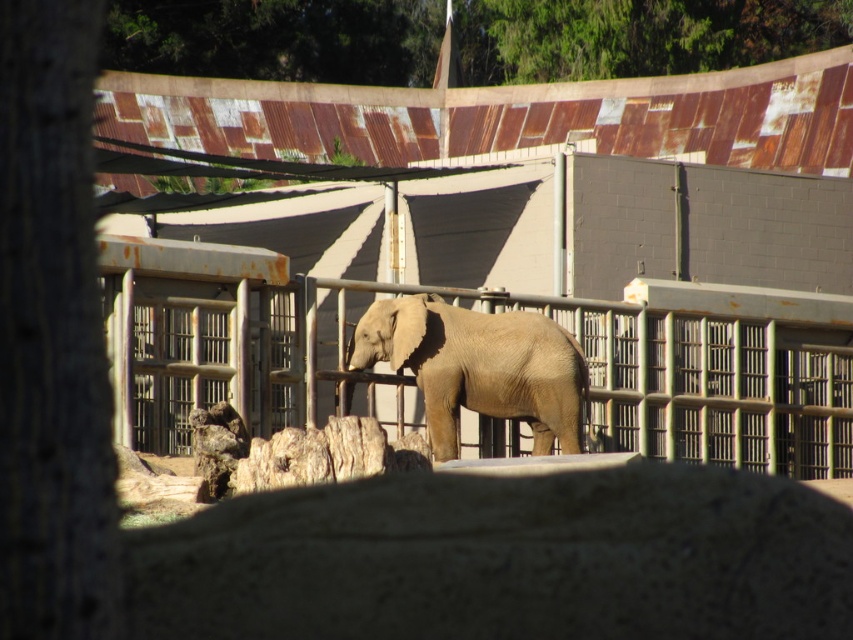
You are standing at the point marked as point (x=65, y=321) and want to reach the elephant in the center of the zoo enclosure. The path between you and the elephant is 16.69 meters long. If your walking speed is 1.5 meters per second, how many seconds will it take you to reach the elephant?

The distance between you and the elephant is 16.69 meters, and your walking speed is 1.5 meters per second. To calculate the time required, divide the distance by the speed. 16.69 divided by 1.5 equals approximately 11.13 seconds. Therefore, it will take about 11.13 seconds to reach the elephant.

You are a zookeeper who needs to move the smooth beige elephant at center to the right side of the brown rough bark tree at left. Is this possible given their current positions?

The brown rough bark tree at left is positioned on the left side of the smooth beige elephant at center. To move the smooth beige elephant at center to the right side of the brown rough bark tree at left, you would need to move it further to the right so that the tree is now on its left, which is possible as long as there is enough space available.

You are a zookeeper trying to guide the smooth beige elephant at center to the brown rough bark tree at left for a feeding session. Based on their positions in the image, which direction should you lead the elephant to reach the tree?

The brown rough bark tree at left is located below the smooth beige elephant at center, so you should guide the elephant downward to reach the tree.